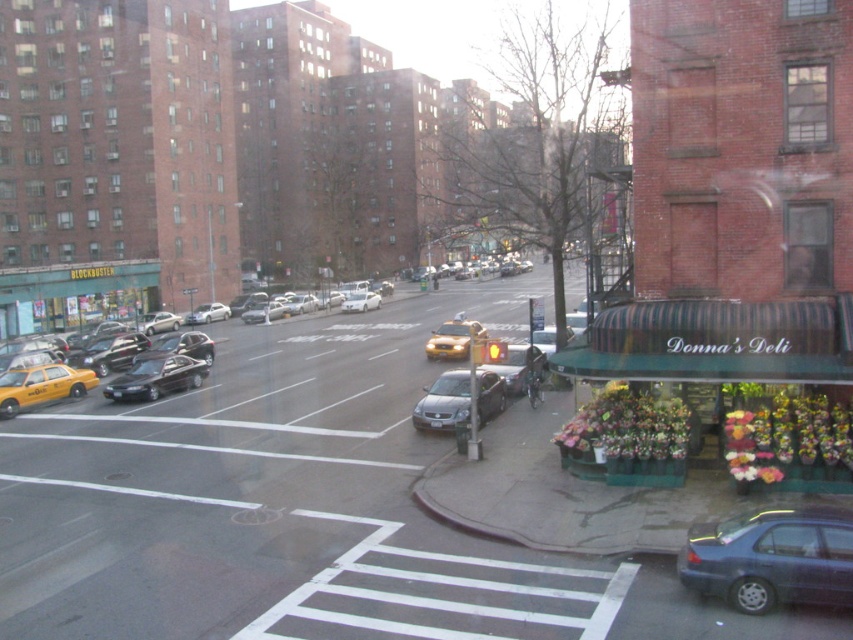
You are a pedestrian standing at the crosswalk and want to cross the street. You see the slate gray sedan at lower right and the yellow rubber taxi at left. Which vehicle is nearer to you?

The slate gray sedan at lower right is closer to the viewer than the yellow rubber taxi at left, so the slate gray sedan at lower right is nearer to you.

You are a pedestrian standing at the crosswalk. You see a slate gray sedan at lower right and a yellow rubber taxi at left. Which vehicle is closer to your right side?

The slate gray sedan at lower right is to the right of the yellow rubber taxi at left, so the slate gray sedan at lower right is closer to your right side.